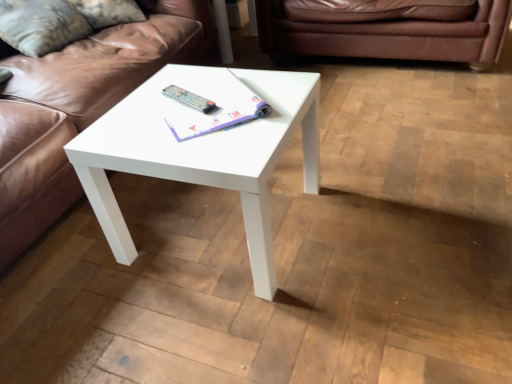
Image resolution: width=512 pixels, height=384 pixels. Find the location of `free spot below white paper book at center (from a real-world perspective)`. free spot below white paper book at center (from a real-world perspective) is located at coordinates (210, 102).